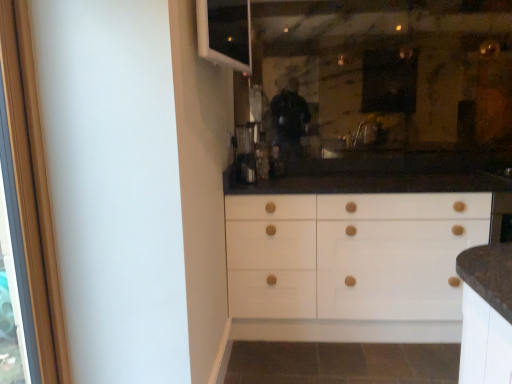
Question: Does metallic silver coffee machine at center have a greater width compared to white plastic window at upper left?

Choices:
 (A) yes
 (B) no

Answer: (A)

Question: Does metallic silver coffee machine at center lie in front of white plastic window at upper left?

Choices:
 (A) no
 (B) yes

Answer: (A)

Question: Is metallic silver coffee machine at center shorter than white plastic window at upper left?

Choices:
 (A) no
 (B) yes

Answer: (B)

Question: Can you confirm if metallic silver coffee machine at center is positioned to the right of white plastic window at upper left?

Choices:
 (A) yes
 (B) no

Answer: (A)

Question: From a real-world perspective, is metallic silver coffee machine at center on top of white plastic window at upper left?

Choices:
 (A) no
 (B) yes

Answer: (A)

Question: In the image, is wooden screen door at left positioned in front of or behind metallic silver coffee machine at center?

Choices:
 (A) front
 (B) behind

Answer: (A)

Question: From the image's perspective, is wooden screen door at left located above or below metallic silver coffee machine at center?

Choices:
 (A) below
 (B) above

Answer: (A)

Question: Considering the relative positions of wooden screen door at left and metallic silver coffee machine at center in the image provided, is wooden screen door at left to the left or to the right of metallic silver coffee machine at center?

Choices:
 (A) right
 (B) left

Answer: (B)

Question: From a real-world perspective, is wooden screen door at left above or below metallic silver coffee machine at center?

Choices:
 (A) above
 (B) below

Answer: (B)

Question: Is wooden screen door at left inside or outside of white plastic window at upper left?

Choices:
 (A) inside
 (B) outside

Answer: (B)

Question: Considering the positions of point (29, 276) and point (245, 72), is point (29, 276) closer or farther from the camera than point (245, 72)?

Choices:
 (A) farther
 (B) closer

Answer: (B)

Question: Considering the positions of wooden screen door at left and white plastic window at upper left in the image, is wooden screen door at left taller or shorter than white plastic window at upper left?

Choices:
 (A) short
 (B) tall

Answer: (B)

Question: Is wooden screen door at left bigger or smaller than white plastic window at upper left?

Choices:
 (A) big
 (B) small

Answer: (A)

Question: Would you say metallic silver coffee machine at center is inside or outside wooden screen door at left?

Choices:
 (A) outside
 (B) inside

Answer: (A)

Question: From the image's perspective, is metallic silver coffee machine at center located above or below wooden screen door at left?

Choices:
 (A) above
 (B) below

Answer: (A)